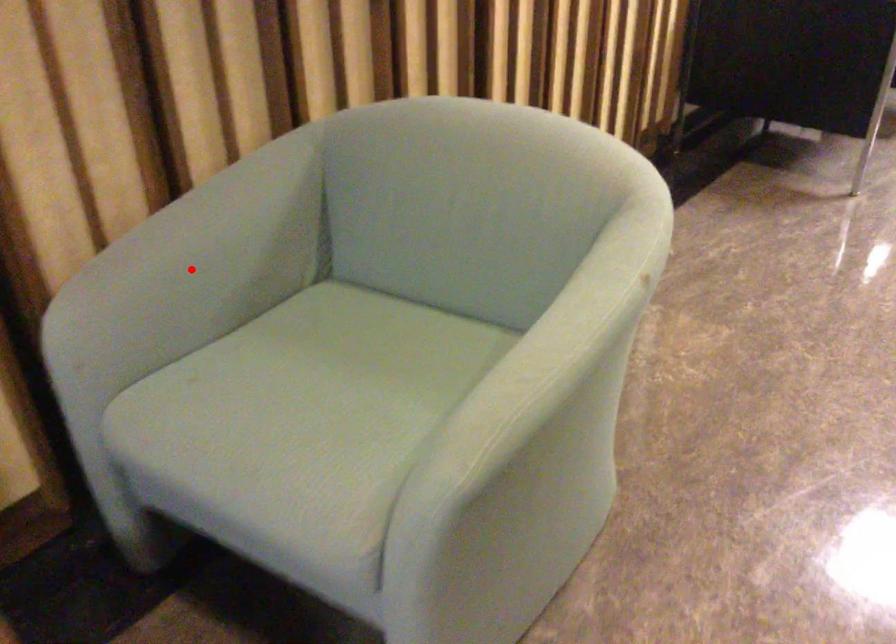
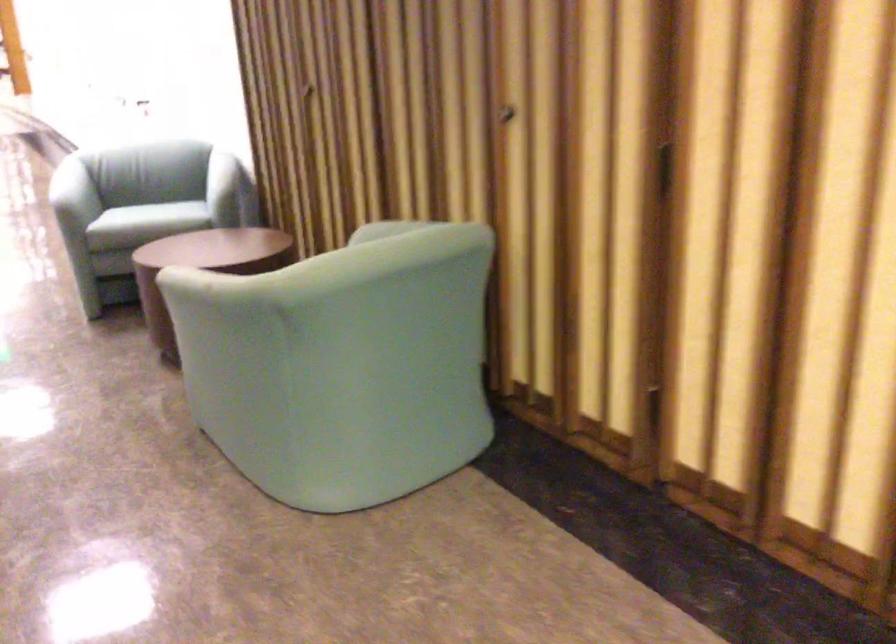
Question: I am providing you with two images of the same scene from different viewpoints. A red point is marked on the first image. Is the red point's position out of view in image 2?

Choices:
 (A) Yes
 (B) No

Answer: (A)